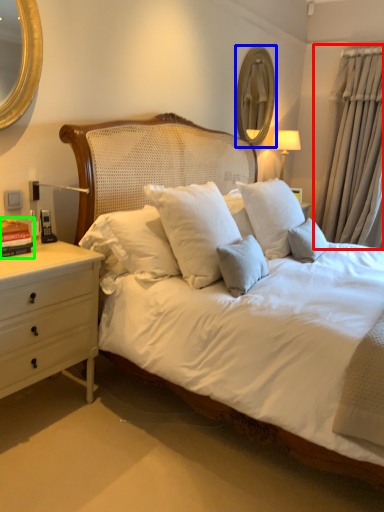
Question: Estimate the real-world distances between objects in this image. Which object is farther from curtain (highlighted by a red box), mirror (highlighted by a blue box) or book (highlighted by a green box)?

Choices:
 (A) mirror
 (B) book

Answer: (B)